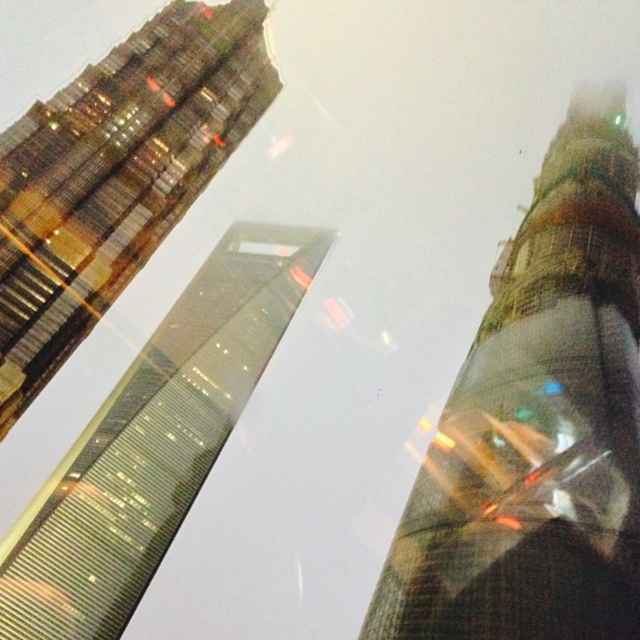
You are a drone operator tasked with flying a drone between the translucent glass tower at center and the glassy reflective skyscraper at upper left. The drone has a maximum flight range of 70 meters. Can the drone safely complete the journey without needing to recharge?

The distance between the translucent glass tower at center and the glassy reflective skyscraper at upper left is 71.71 meters, which exceeds the drone operator mentioned maximum flight range of 70 meters. Therefore, the drone cannot safely complete the journey without needing to recharge.

You are a drone operator who needs to fly a drone between the translucent glass tower at center and the reflective glass skyscraper at center. The drone has a maximum flight distance of 200 meters. Can the drone safely fly between them without exceeding its range?

The translucent glass tower at center is 180.32 meters from the reflective glass skyscraper at center. Since the drone can fly up to 200 meters, it can safely fly between them as the distance is within its range.

Based on the photo, you are standing at the base of the central skyscraper and notice two points marked on the image. The first point is at coordinate point (515, 618) and the second at point (77, 614). From your vantage point, which point appears closer to you?

Point (515, 618) is in front of point (77, 614), so it appears closer to you.